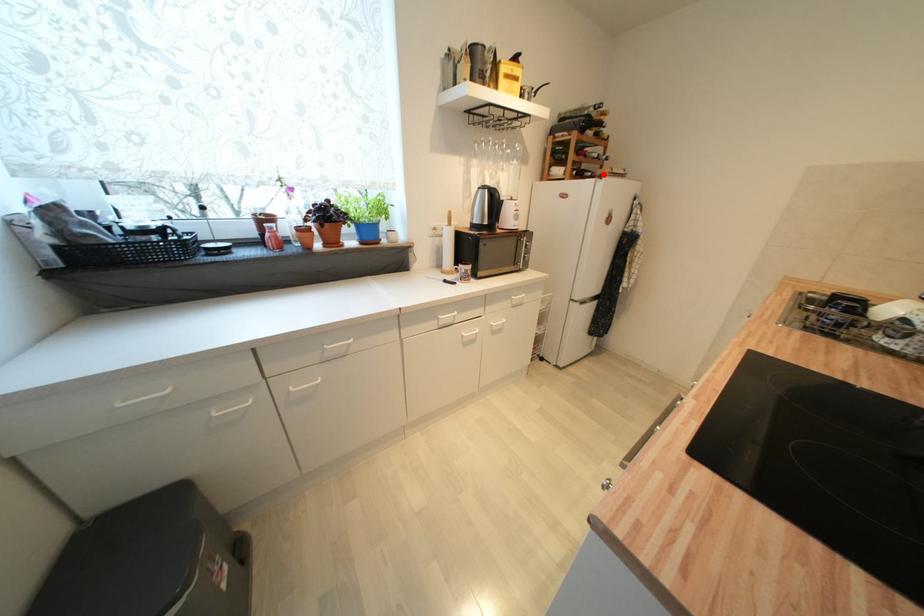
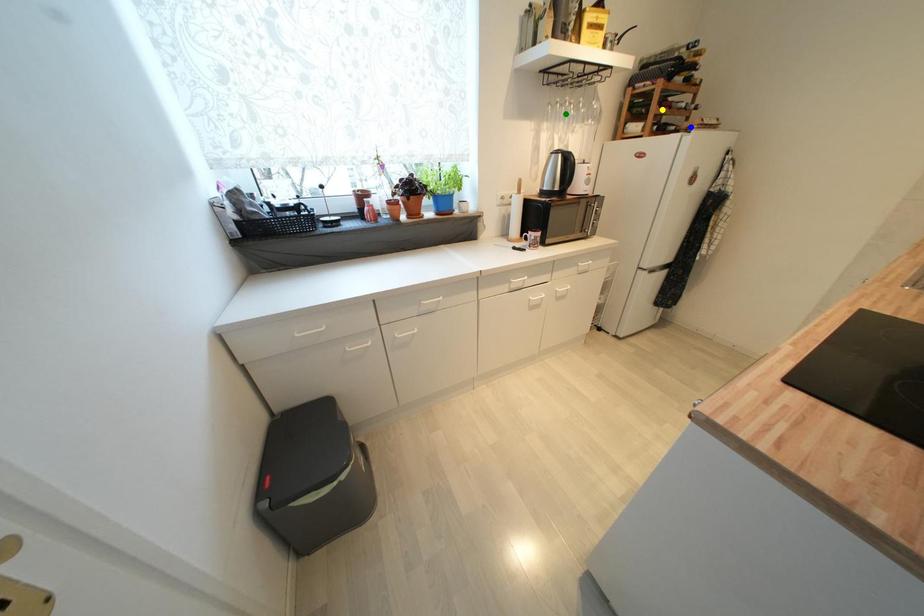
Question: I am providing you with two images of the same scene from different viewpoints. A red point is marked on the first image. You are given multiple points on the second image. Which point in image 2 is actually the same real-world point as the red point in image 1?

Choices:
 (A) green point
 (B) yellow point
 (C) blue point

Answer: (C)